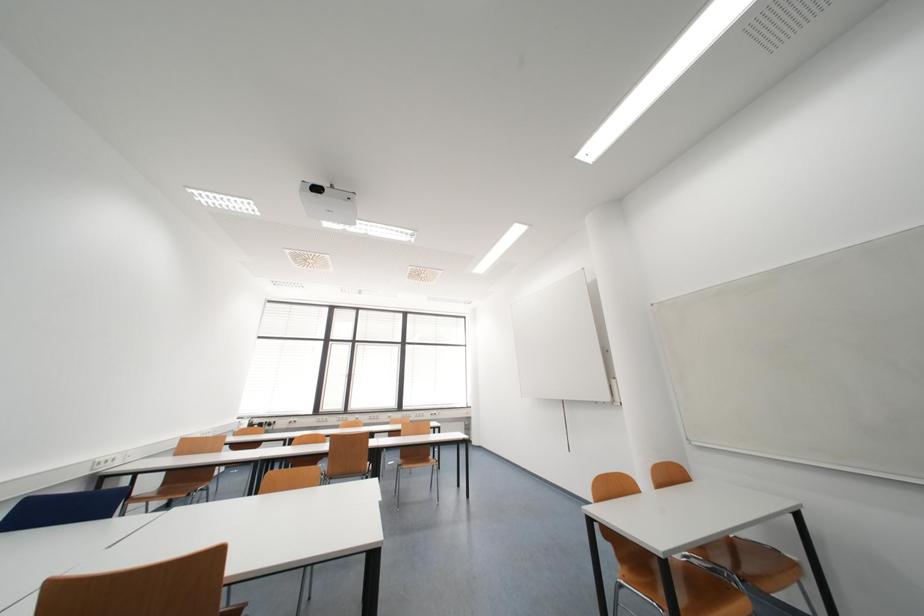
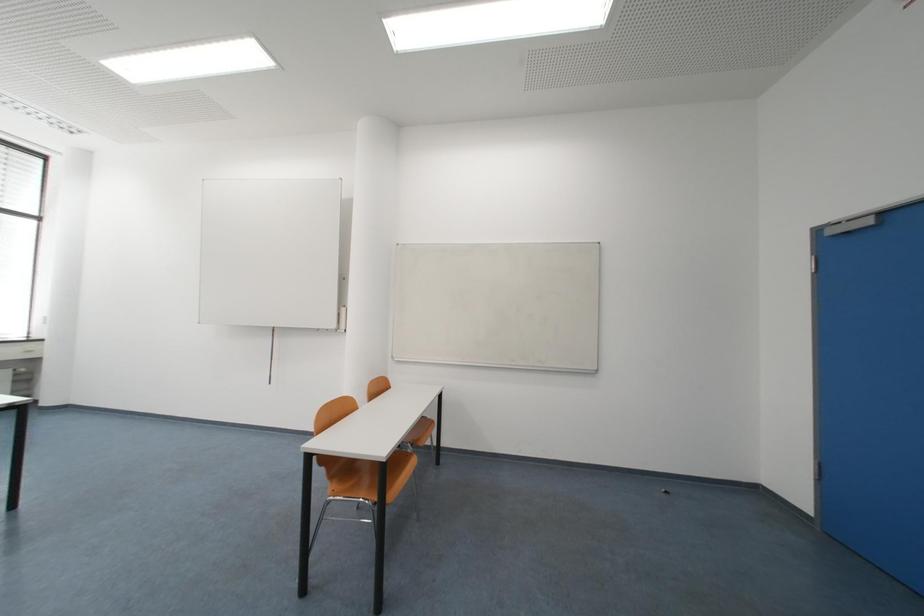
Question: The first image is from the beginning of the video and the second image is from the end. How did the camera likely rotate when shooting the video?

Choices:
 (A) Left
 (B) Right
 (C) Up
 (D) Down

Answer: (B)